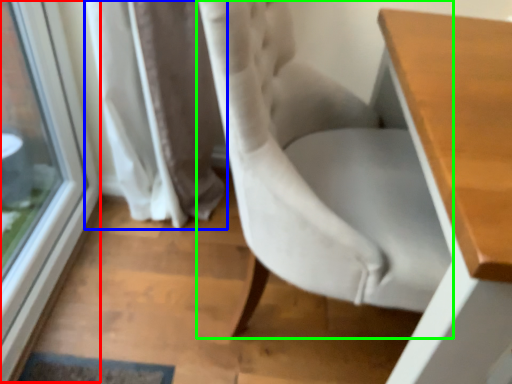
Question: Estimate the real-world distances between objects in this image. Which object is closer to window (highlighted by a red box), curtain (highlighted by a blue box) or chair (highlighted by a green box)?

Choices:
 (A) curtain
 (B) chair

Answer: (A)